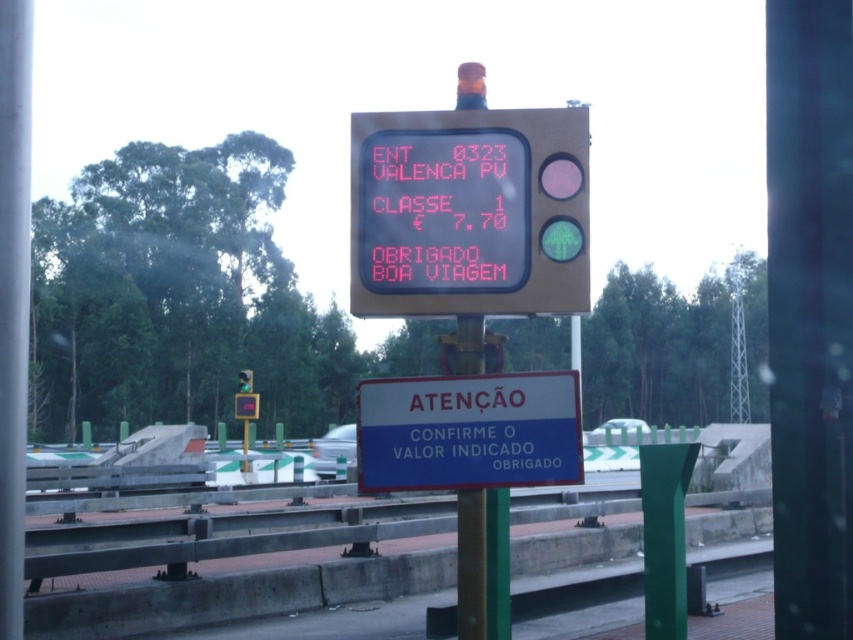
Does blue plastic sign at center lie behind green glass traffic light at upper center?

That is False.

Is point (572, 477) closer to viewer compared to point (242, 388)?

That is True.

You are a GUI agent. You are given a task and a screenshot of the screen. Output one action in this format:
    pyautogui.click(x=<x>, y=<y>)
    Task: Click on the blue plastic sign at center
    
    Given the screenshot: What is the action you would take?
    pyautogui.click(x=468, y=432)